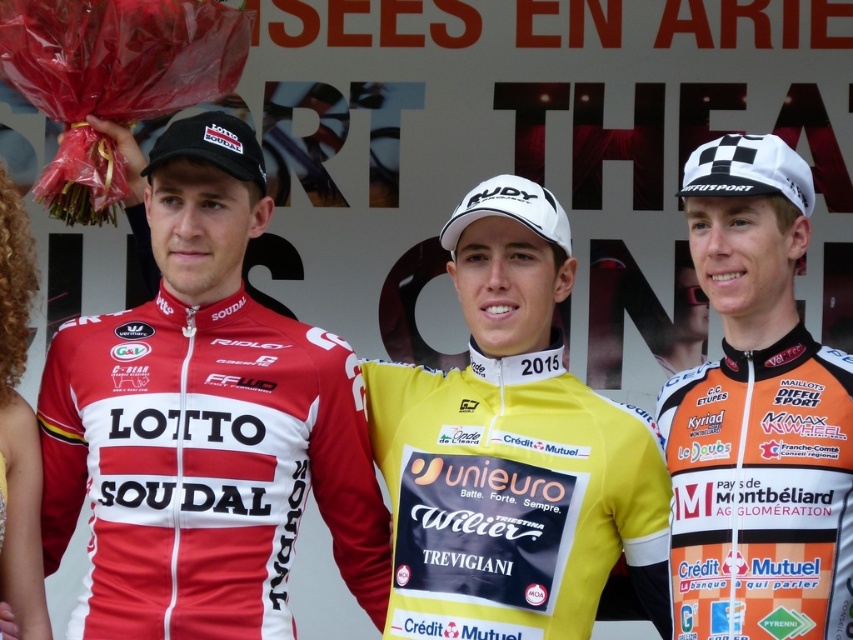
Is orange jersey at right below white checkered fabric cap at upper right?

Yes.

Is orange jersey at right thinner than white checkered fabric cap at upper right?

No, orange jersey at right is not thinner than white checkered fabric cap at upper right.

The width and height of the screenshot is (853, 640). Identify the location of orange jersey at right. (761, 492).

Is matte red jersey at center to the left of orange jersey at right from the viewer's perspective?

Yes, matte red jersey at center is to the left of orange jersey at right.

Does matte red jersey at center appear on the right side of orange jersey at right?

Incorrect, matte red jersey at center is not on the right side of orange jersey at right.

This screenshot has height=640, width=853. In order to click on matte red jersey at center in this screenshot , I will do coord(204,467).

Does matte red jersey at center appear on the left side of white checkered fabric cap at upper right?

Correct, you'll find matte red jersey at center to the left of white checkered fabric cap at upper right.

Who is more distant from viewer, (82, 384) or (804, 164)?

Positioned behind is point (82, 384).

Is point (283, 515) in front of point (756, 145)?

That is False.

Identify the location of matte red jersey at center. (204, 467).